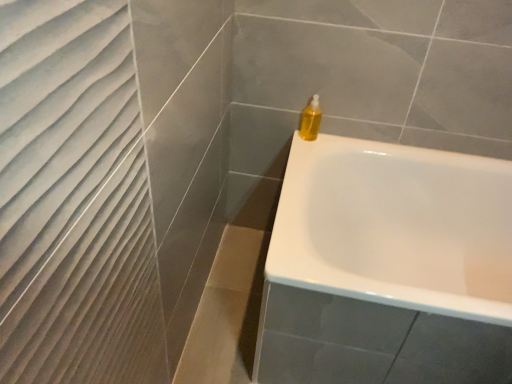
At what (x,y) coordinates should I click in order to perform the action: click on free space on the front side of translucent yellow liquid at upper right. Please return your answer as a coordinate pair (x, y). The width and height of the screenshot is (512, 384). Looking at the image, I should click on (302, 150).